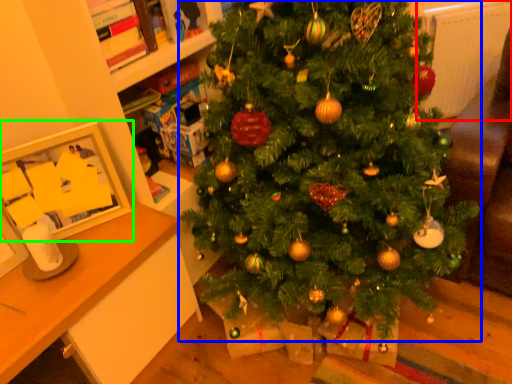
Question: Considering the real-world distances, which object is farthest from radiator (highlighted by a red box)? christmas tree (highlighted by a blue box) or picture frame (highlighted by a green box)?

Choices:
 (A) christmas tree
 (B) picture frame

Answer: (B)